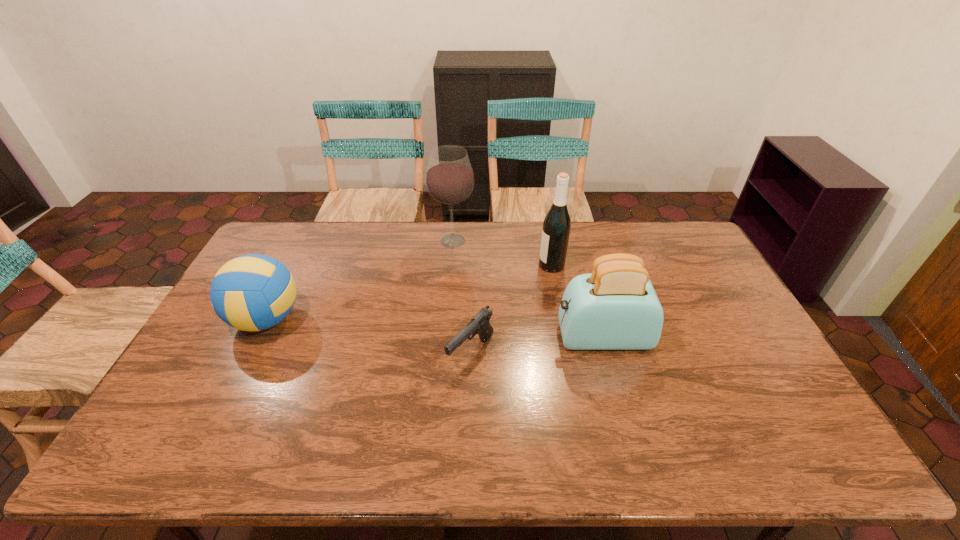
At what (x,y) coordinates should I click in order to perform the action: click on vacant space at the right edge of the desktop. Please return your answer as a coordinate pair (x, y). Looking at the image, I should click on (733, 376).

Image resolution: width=960 pixels, height=540 pixels. I want to click on free space at the far left corner, so click(x=304, y=228).

Locate an element on the screen. free space at the far right corner is located at coordinates (693, 253).

The width and height of the screenshot is (960, 540). Find the location of `free space between the third tallest object and the farthest object`. free space between the third tallest object and the farthest object is located at coordinates (528, 289).

Image resolution: width=960 pixels, height=540 pixels. What are the coordinates of `blank region between the alcohol and the gun` in the screenshot? It's located at (462, 297).

Find the location of `unoccupied position between the second shortest object and the alcohol`. unoccupied position between the second shortest object and the alcohol is located at coordinates (360, 280).

Identify the location of vacant point located between the leftmost object and the toaster. The image size is (960, 540). (434, 328).

Find the location of a particular element. The height and width of the screenshot is (540, 960). free space between the second farthest object and the leftmost object is located at coordinates (409, 292).

Where is `empty space that is in between the farthest object and the second shortest object`? The image size is (960, 540). empty space that is in between the farthest object and the second shortest object is located at coordinates [x=360, y=280].

The width and height of the screenshot is (960, 540). I want to click on vacant area that lies between the shortest object and the third shortest object, so click(x=537, y=345).